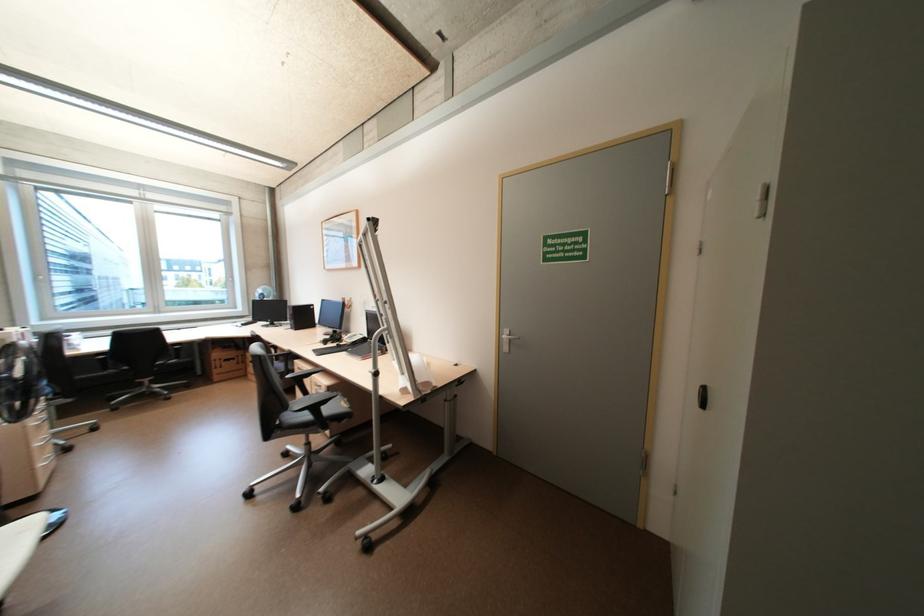
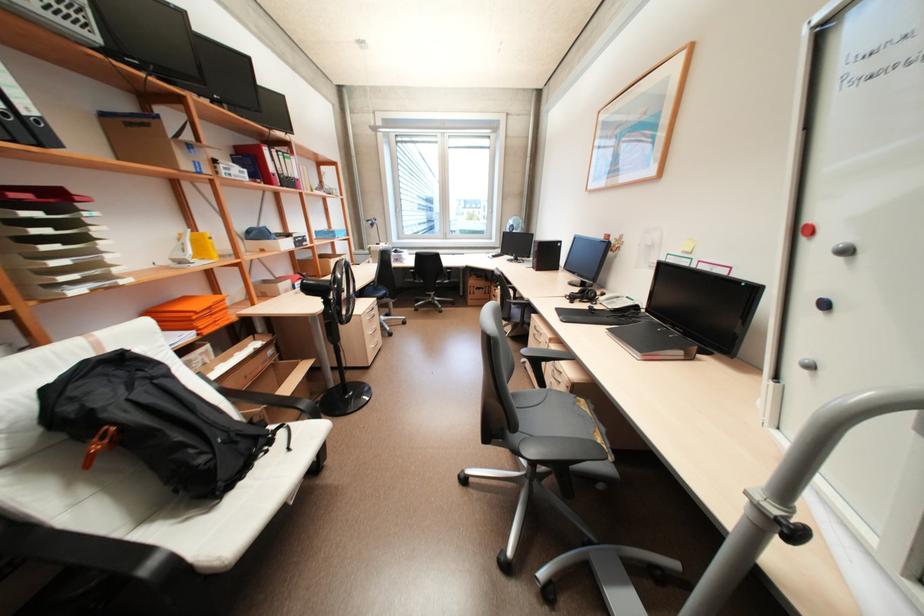
The point at (383,300) is marked in the first image. Where is the corresponding point in the second image?

(852, 252)